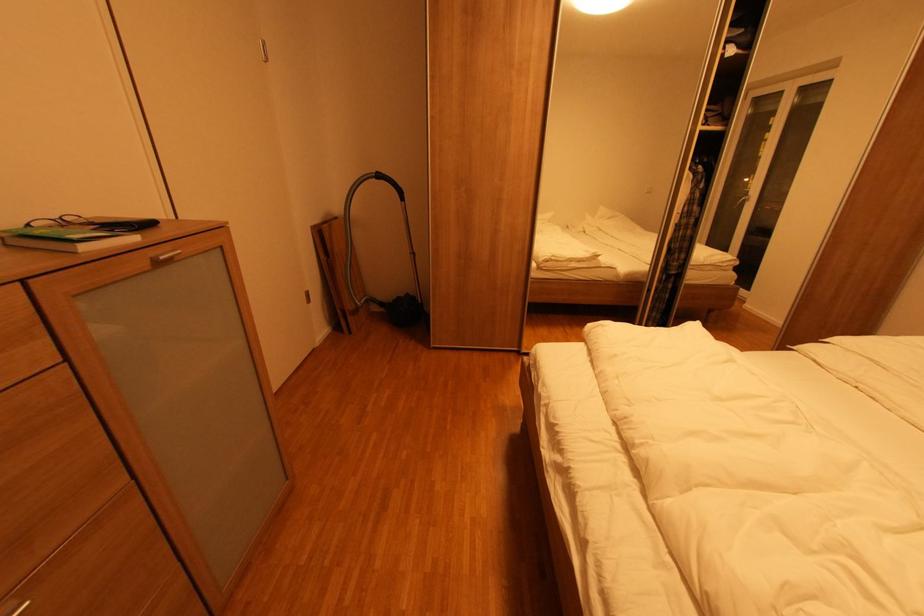
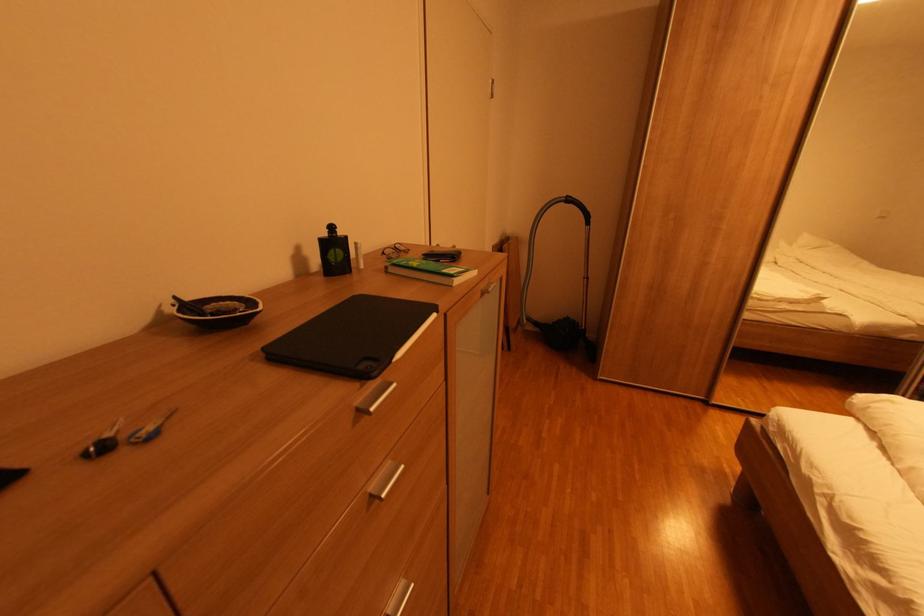
Locate, in the second image, the point that corresponds to pixel 380 180 in the first image.

(568, 205)